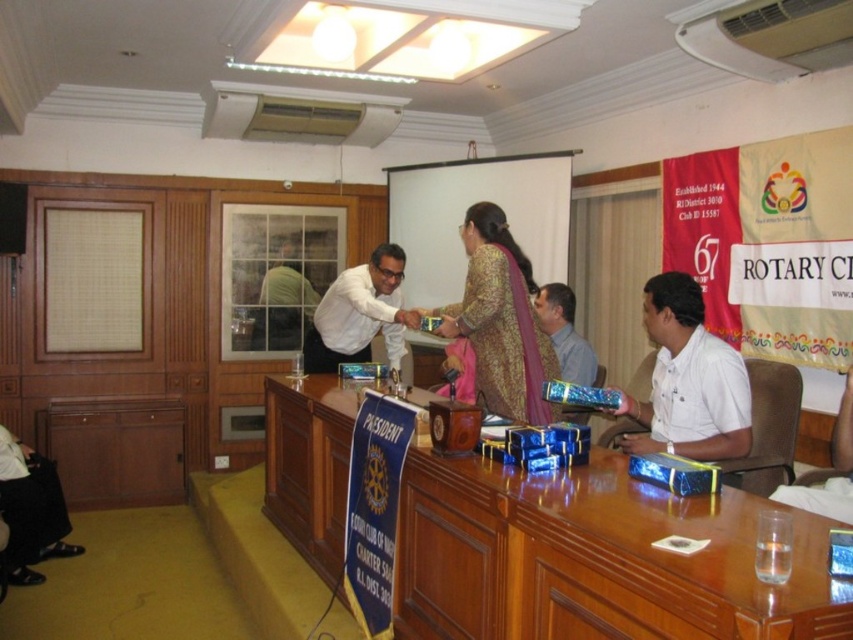
You are attending a formal event and want to take a photo of the gold brocade dress at center from a distance of 10 feet. Can you capture it clearly without moving closer?

The gold brocade dress at center is 9.62 feet from viewer, so yes, you can capture it clearly from 10 feet without moving closer as the distance is sufficient.

You are standing at the center of the conference room and want to pick up an item from the table. There are two points marked on the table surface. Which point is closer to you, point (492, 289) or point (285, 289)?

Point (492, 289) is closer to the camera, so it is closer to you.